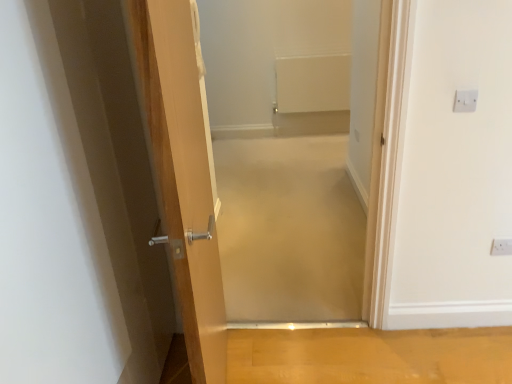
Question: Would you say white plastic electric outlet at upper right, the first electric outlet viewed from the front, is outside beige carpet at center, placed as the 1th corridor when sorted from back to front?

Choices:
 (A) no
 (B) yes

Answer: (B)

Question: Are white plastic electric outlet at upper right, which is the second electric outlet in bottom-to-top order, and beige carpet at center, placed as the 1th corridor when sorted from back to front, far apart?

Choices:
 (A) no
 (B) yes

Answer: (B)

Question: From a real-world perspective, is white plastic electric outlet at upper right, which is the 1th electric outlet in top-to-bottom order, physically below beige carpet at center, which appears as the 2th corridor when viewed from the front?

Choices:
 (A) no
 (B) yes

Answer: (A)

Question: Is beige carpet at center, which appears as the 2th corridor when viewed from the front, inside white plastic electric outlet at upper right, acting as the first electric outlet starting from the left?

Choices:
 (A) no
 (B) yes

Answer: (A)

Question: Can you confirm if white plastic electric outlet at upper right, which ranks as the 2th electric outlet in right-to-left order, is thinner than beige carpet at center, placed as the 1th corridor when sorted from back to front?

Choices:
 (A) no
 (B) yes

Answer: (B)

Question: Is white plastic electric outlet at upper right, the 2th electric outlet in the top-to-bottom sequence, wider or thinner than white plastic electric outlet at upper right, acting as the first electric outlet starting from the left?

Choices:
 (A) thin
 (B) wide

Answer: (A)

Question: Considering the positions of point (496, 243) and point (466, 102), is point (496, 243) closer or farther from the camera than point (466, 102)?

Choices:
 (A) farther
 (B) closer

Answer: (A)

Question: From a real-world perspective, is white plastic electric outlet at upper right, which is counted as the 2th electric outlet, starting from the left, above or below white plastic electric outlet at upper right, the second electric outlet from the back?

Choices:
 (A) below
 (B) above

Answer: (A)

Question: Considering the positions of white plastic electric outlet at upper right, the 2th electric outlet in the top-to-bottom sequence, and white plastic electric outlet at upper right, acting as the first electric outlet starting from the left, in the image, is white plastic electric outlet at upper right, the 2th electric outlet in the top-to-bottom sequence, bigger or smaller than white plastic electric outlet at upper right, acting as the first electric outlet starting from the left,?

Choices:
 (A) big
 (B) small

Answer: (A)

Question: Is beige carpet at center, which ranks as the second corridor in back-to-front order, to the left or to the right of white plastic electric outlet at upper right, which ranks as the 2th electric outlet in right-to-left order, in the image?

Choices:
 (A) left
 (B) right

Answer: (A)

Question: Considering the positions of beige carpet at center, the 1th corridor from the front, and white plastic electric outlet at upper right, the first electric outlet viewed from the front, in the image, is beige carpet at center, the 1th corridor from the front, taller or shorter than white plastic electric outlet at upper right, the first electric outlet viewed from the front,?

Choices:
 (A) tall
 (B) short

Answer: (A)

Question: Looking at their shapes, would you say beige carpet at center, the 1th corridor from the front, is wider or thinner than white plastic electric outlet at upper right, which is the second electric outlet in bottom-to-top order?

Choices:
 (A) thin
 (B) wide

Answer: (B)

Question: From a real-world perspective, is beige carpet at center, which ranks as the second corridor in back-to-front order, physically located above or below white plastic electric outlet at upper right, which ranks as the 2th electric outlet in right-to-left order?

Choices:
 (A) below
 (B) above

Answer: (A)

Question: Considering the positions of beige carpet at center, the 1th corridor from the front, and wooden floor at lower center in the image, is beige carpet at center, the 1th corridor from the front, bigger or smaller than wooden floor at lower center?

Choices:
 (A) small
 (B) big

Answer: (B)

Question: Considering their positions, is beige carpet at center, which ranks as the second corridor in back-to-front order, located in front of or behind wooden floor at lower center?

Choices:
 (A) behind
 (B) front

Answer: (B)